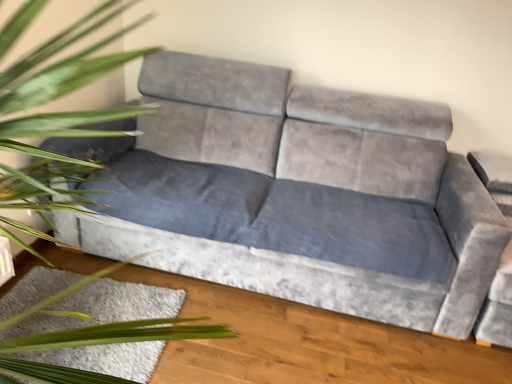
Question: Is green leafy plant at left located outside velvet grey couch at center?

Choices:
 (A) yes
 (B) no

Answer: (A)

Question: From the image's perspective, is green leafy plant at left located above velvet grey couch at center?

Choices:
 (A) no
 (B) yes

Answer: (A)

Question: From a real-world perspective, is green leafy plant at left positioned over velvet grey couch at center based on gravity?

Choices:
 (A) yes
 (B) no

Answer: (A)

Question: From the image's perspective, is green leafy plant at left located beneath velvet grey couch at center?

Choices:
 (A) yes
 (B) no

Answer: (A)

Question: Does green leafy plant at left appear on the left side of velvet grey couch at center?

Choices:
 (A) yes
 (B) no

Answer: (A)

Question: Is green leafy plant at left situated inside velvet grey couch at center or outside?

Choices:
 (A) outside
 (B) inside

Answer: (A)

Question: From the image's perspective, is green leafy plant at left located above or below velvet grey couch at center?

Choices:
 (A) above
 (B) below

Answer: (B)

Question: Considering the relative positions of green leafy plant at left and velvet grey couch at center in the image provided, is green leafy plant at left to the left or to the right of velvet grey couch at center?

Choices:
 (A) left
 (B) right

Answer: (A)

Question: In terms of width, does green leafy plant at left look wider or thinner when compared to velvet grey couch at center?

Choices:
 (A) wide
 (B) thin

Answer: (A)

Question: Is velvet grey couch at center bigger or smaller than white shaggy rug at lower left?

Choices:
 (A) small
 (B) big

Answer: (B)

Question: Is point pos(369,215) positioned closer to the camera than point pos(118,299)?

Choices:
 (A) closer
 (B) farther

Answer: (B)

Question: Considering the positions of velvet grey couch at center and white shaggy rug at lower left in the image, is velvet grey couch at center taller or shorter than white shaggy rug at lower left?

Choices:
 (A) short
 (B) tall

Answer: (B)

Question: From a real-world perspective, relative to white shaggy rug at lower left, is velvet grey couch at center vertically above or below?

Choices:
 (A) above
 (B) below

Answer: (A)

Question: Considering the positions of white shaggy rug at lower left and green leafy plant at left in the image, is white shaggy rug at lower left taller or shorter than green leafy plant at left?

Choices:
 (A) tall
 (B) short

Answer: (B)

Question: From a real-world perspective, is white shaggy rug at lower left positioned above or below green leafy plant at left?

Choices:
 (A) above
 (B) below

Answer: (B)